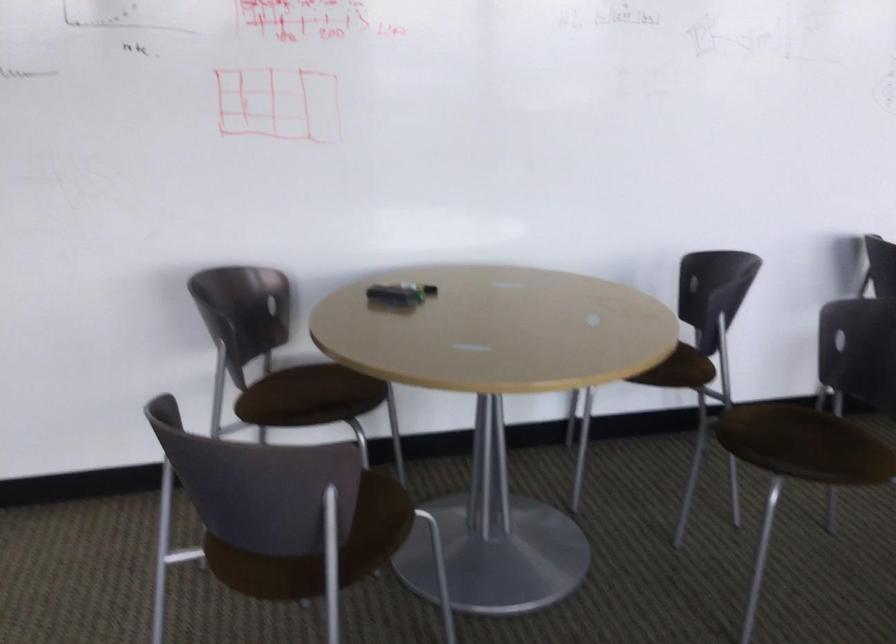
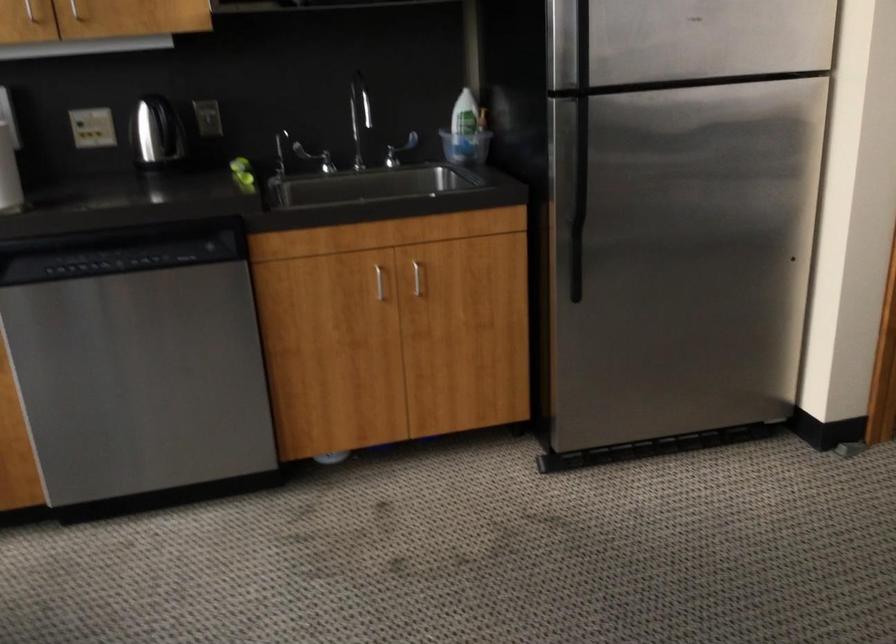
The images are taken continuously from a first-person perspective. In which direction is your viewpoint rotating?

The camera rotated toward left-down.